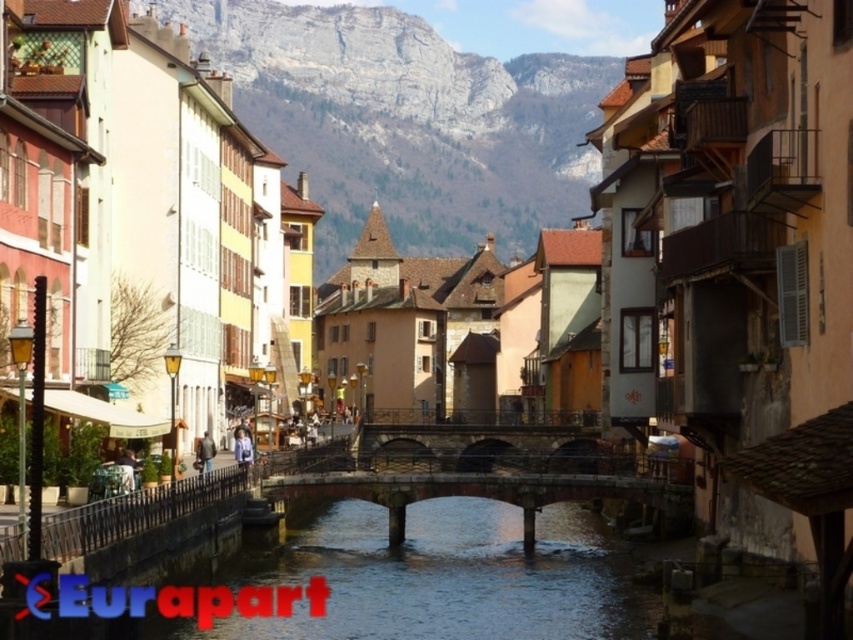
Question: Is rocky gray mountain at center further to the viewer compared to stone bridge at center?

Choices:
 (A) yes
 (B) no

Answer: (A)

Question: Estimate the real-world distances between objects in this image. Which object is farther from the stone bridge at center?

Choices:
 (A) stone arch bridge at center
 (B) rocky gray mountain at center

Answer: (B)

Question: Which point is closer to the camera?

Choices:
 (A) rocky gray mountain at center
 (B) stone arch bridge at center

Answer: (B)

Question: Is stone bridge at center positioned at the back of stone arch bridge at center?

Choices:
 (A) yes
 (B) no

Answer: (B)

Question: Which is nearer to the stone bridge at center?

Choices:
 (A) rocky gray mountain at center
 (B) stone arch bridge at center

Answer: (B)

Question: Is rocky gray mountain at center to the right of stone bridge at center from the viewer's perspective?

Choices:
 (A) no
 (B) yes

Answer: (A)